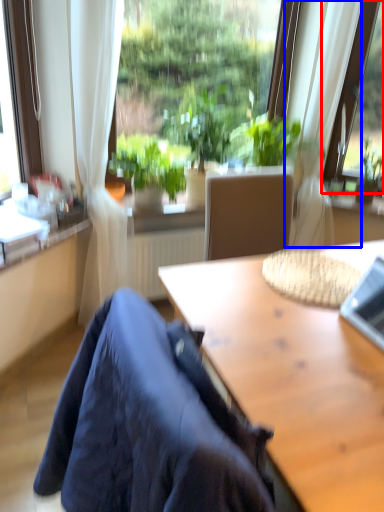
Question: Which object appears farthest to the camera in this image, window (highlighted by a red box) or curtain (highlighted by a blue box)?

Choices:
 (A) window
 (B) curtain

Answer: (A)